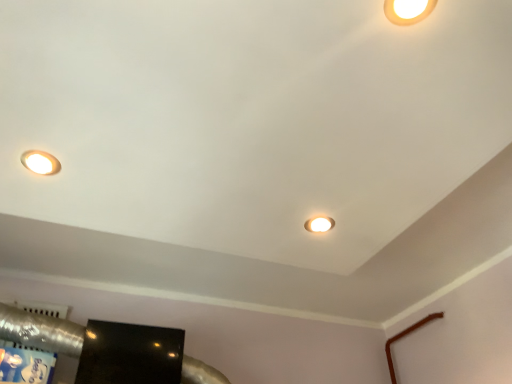
Question: Which direction should I rotate to look at matte white lamp at center, which ranks as the second lamp in right-to-left order, — up or down?

Choices:
 (A) down
 (B) up

Answer: (A)

Question: Is matte white lamp at center, marked as the first lamp in a back-to-front arrangement, oriented away from matte white lamp at upper left, which appears as the 2th lamp when ordered from the bottom?

Choices:
 (A) yes
 (B) no

Answer: (B)

Question: Considering the relative sizes of matte white lamp at center, acting as the 2th lamp starting from the left, and matte white lamp at upper left, which is counted as the 2th lamp, starting from the top, in the image provided, is matte white lamp at center, acting as the 2th lamp starting from the left, shorter than matte white lamp at upper left, which is counted as the 2th lamp, starting from the top,?

Choices:
 (A) no
 (B) yes

Answer: (A)

Question: Does matte white lamp at center, which is the third lamp in front-to-back order, lie behind matte white lamp at upper left, the first lamp from the left?

Choices:
 (A) no
 (B) yes

Answer: (B)

Question: From a real-world perspective, is matte white lamp at center, which ranks as the second lamp in right-to-left order, located higher than matte white lamp at upper left, marked as the 2th lamp in a back-to-front arrangement?

Choices:
 (A) no
 (B) yes

Answer: (B)

Question: Does matte white lamp at center, which is counted as the third lamp, starting from the top, touch matte white lamp at upper left, which appears as the 2th lamp when ordered from the bottom?

Choices:
 (A) no
 (B) yes

Answer: (A)

Question: Does matte white lamp at center, which is the third lamp in front-to-back order, have a lesser width compared to matte white lamp at upper left, which is counted as the 2th lamp, starting from the top?

Choices:
 (A) no
 (B) yes

Answer: (A)

Question: Is matte white lamp at upper left, placed as the second lamp when sorted from front to back, turned away from matte white lamp at upper right, the third lamp when ordered from bottom to top?

Choices:
 (A) yes
 (B) no

Answer: (B)

Question: Can you confirm if matte white lamp at upper left, which is counted as the 2th lamp, starting from the top, is positioned to the right of matte white lamp at upper right, which ranks as the 1th lamp in right-to-left order?

Choices:
 (A) yes
 (B) no

Answer: (B)

Question: Is matte white lamp at upper left, marked as the 2th lamp in a back-to-front arrangement, closer to the viewer compared to matte white lamp at upper right, which appears as the third lamp when viewed from the back?

Choices:
 (A) yes
 (B) no

Answer: (B)

Question: Considering the relative positions of matte white lamp at upper left, marked as the 2th lamp in a back-to-front arrangement, and matte white lamp at upper right, the third lamp when ordered from bottom to top, in the image provided, is matte white lamp at upper left, marked as the 2th lamp in a back-to-front arrangement, behind matte white lamp at upper right, the third lamp when ordered from bottom to top,?

Choices:
 (A) yes
 (B) no

Answer: (A)

Question: Does matte white lamp at upper left, placed as the second lamp when sorted from front to back, contain matte white lamp at upper right, arranged as the 1th lamp when viewed from the front?

Choices:
 (A) no
 (B) yes

Answer: (A)

Question: Can we say matte white lamp at upper left, marked as the 2th lamp in a back-to-front arrangement, lies outside matte white lamp at upper right, which appears as the 1th lamp when viewed from the top?

Choices:
 (A) no
 (B) yes

Answer: (B)

Question: Is matte white lamp at upper left, placed as the second lamp when sorted from front to back, in contact with glossy black tv at lower left?

Choices:
 (A) no
 (B) yes

Answer: (A)